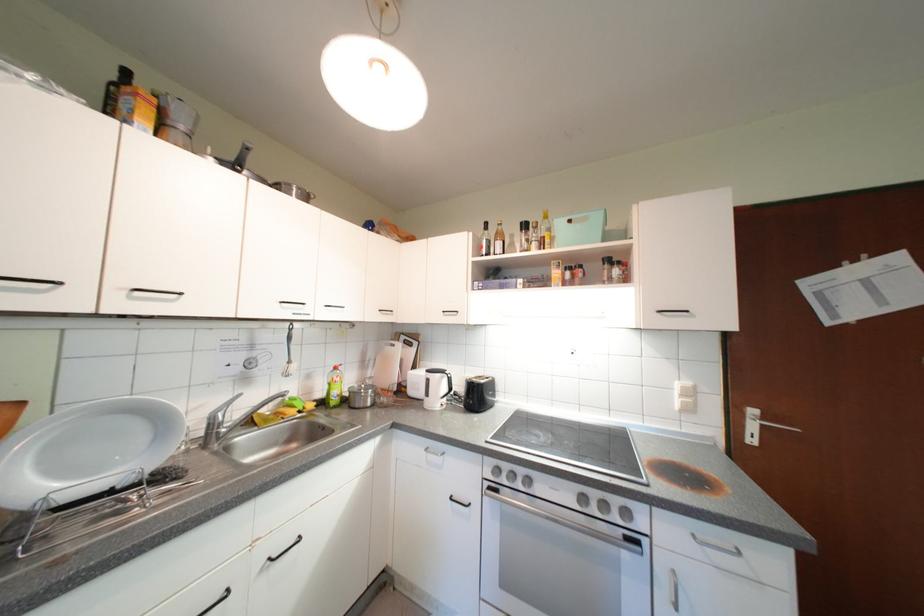
Describe the element at coordinates (685, 391) in the screenshot. I see `a white light switch` at that location.